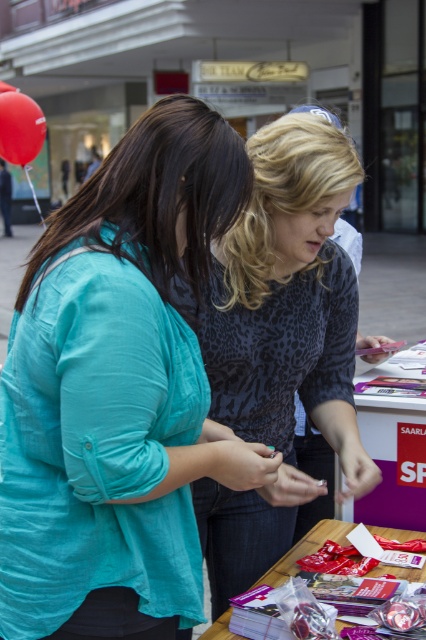
Question: Is teal fabric shirt at center positioned in front of matte plastic table at lower center?

Choices:
 (A) yes
 (B) no

Answer: (A)

Question: Considering the real-world distances, which object is farthest from the matte plastic table at center?

Choices:
 (A) leopard print blouse at center
 (B) matte plastic table at lower center

Answer: (A)

Question: Can you confirm if teal fabric shirt at center is thinner than matte plastic table at center?

Choices:
 (A) yes
 (B) no

Answer: (B)

Question: Which object is closer to the camera taking this photo?

Choices:
 (A) leopard print blouse at center
 (B) matte plastic table at center
 (C) matte plastic table at lower center

Answer: (A)

Question: Among these objects, which one is nearest to the camera?

Choices:
 (A) teal fabric shirt at center
 (B) matte plastic table at lower center

Answer: (A)

Question: Does leopard print blouse at center appear on the right side of matte plastic table at lower center?

Choices:
 (A) yes
 (B) no

Answer: (B)